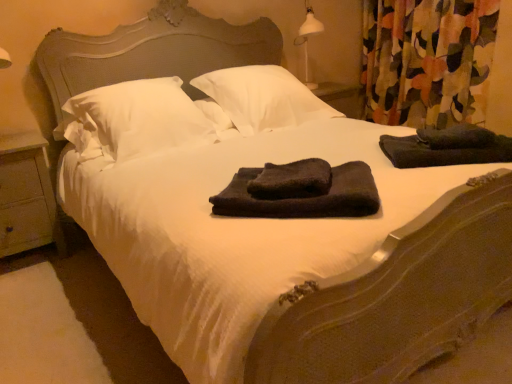
Question: From the image's perspective, would you say wooden at left is positioned over dark gray towel at right?

Choices:
 (A) yes
 (B) no

Answer: (B)

Question: Considering the relative sizes of wooden at left and dark gray towel at right in the image provided, is wooden at left bigger than dark gray towel at right?

Choices:
 (A) yes
 (B) no

Answer: (A)

Question: Considering the relative positions of wooden at left and dark gray towel at right in the image provided, is wooden at left to the left of dark gray towel at right from the viewer's perspective?

Choices:
 (A) no
 (B) yes

Answer: (B)

Question: From a real-world perspective, does wooden at left sit lower than dark gray towel at right?

Choices:
 (A) yes
 (B) no

Answer: (A)

Question: Considering the relative sizes of wooden at left and dark gray towel at right in the image provided, is wooden at left wider than dark gray towel at right?

Choices:
 (A) no
 (B) yes

Answer: (B)

Question: Is wooden at left not inside dark gray towel at right?

Choices:
 (A) yes
 (B) no

Answer: (A)

Question: Is dark gray towel at right to the right of dark gray plush bath towel at center, arranged as the first bath towel when viewed from the right, from the viewer's perspective?

Choices:
 (A) yes
 (B) no

Answer: (A)

Question: From the image's perspective, is dark gray towel at right beneath dark gray plush bath towel at center, arranged as the first bath towel when viewed from the right?

Choices:
 (A) no
 (B) yes

Answer: (A)

Question: Can you confirm if dark gray towel at right is shorter than dark gray plush bath towel at center, placed as the second bath towel when sorted from left to right?

Choices:
 (A) no
 (B) yes

Answer: (A)

Question: From a real-world perspective, does dark gray towel at right stand above dark gray plush bath towel at center, arranged as the first bath towel when viewed from the right?

Choices:
 (A) no
 (B) yes

Answer: (B)

Question: Is dark gray towel at right outside of dark gray plush bath towel at center, arranged as the first bath towel when viewed from the right?

Choices:
 (A) no
 (B) yes

Answer: (B)

Question: Does dark gray towel at right contain dark gray plush bath towel at center, placed as the second bath towel when sorted from left to right?

Choices:
 (A) no
 (B) yes

Answer: (A)

Question: Is white soft pillow at center, which appears as the first pillow when viewed from the right, wider than wooden at left?

Choices:
 (A) no
 (B) yes

Answer: (B)